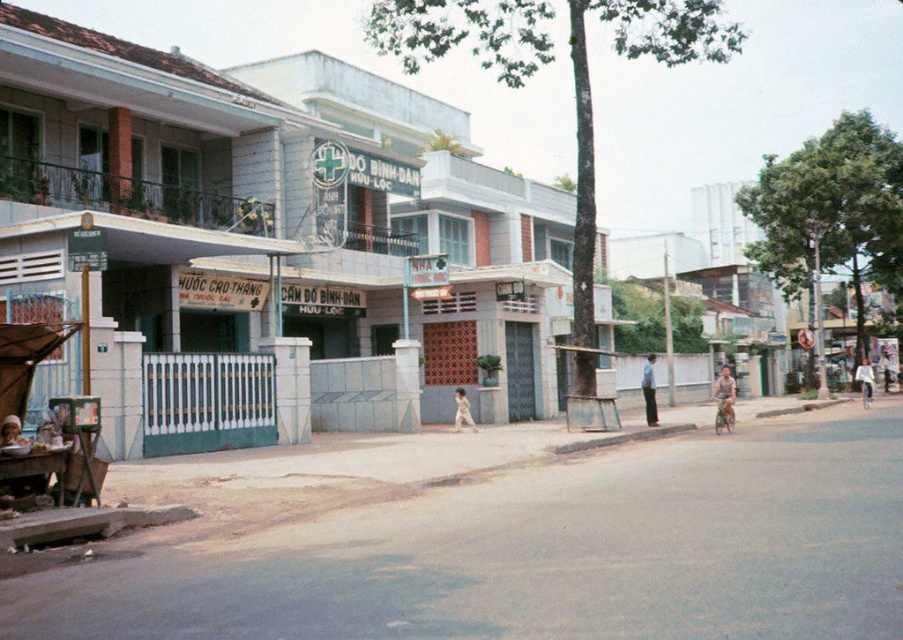
Can you confirm if smooth skin face at center is positioned to the right of light brown leather jacket at center?

Incorrect, smooth skin face at center is not on the right side of light brown leather jacket at center.

Which is above, smooth skin face at center or light brown leather jacket at center?

smooth skin face at center

Identify the location of smooth skin face at center. (11, 432).

Locate an element on the screen. smooth skin face at center is located at coordinates (11, 432).

Between white concrete building at center and light brown leather jacket at center, which one is positioned lower?

light brown leather jacket at center is below.

Between point (523, 358) and point (466, 419), which one is positioned in front?

Point (466, 419) is more forward.

Locate an element on the screen. Image resolution: width=903 pixels, height=640 pixels. white concrete building at center is located at coordinates (271, 216).

Looking at this image, can you confirm if light brown wooden bicycle at center-right is thinner than dark blue pants at center?

Incorrect, light brown wooden bicycle at center-right's width is not less than dark blue pants at center's.

Identify the location of light brown wooden bicycle at center-right. The height and width of the screenshot is (640, 903). (724, 396).

Measure the distance between light brown wooden bicycle at center-right and camera.

They are 22.93 meters apart.

Locate an element on the screen. This screenshot has height=640, width=903. light brown wooden bicycle at center-right is located at coordinates (724, 396).